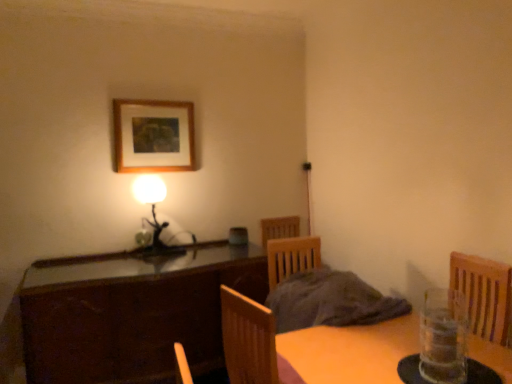
Question: In the image, is wooden picture frame at upper center positioned in front of or behind dark wood cabinet at center?

Choices:
 (A) behind
 (B) front

Answer: (A)

Question: Is point (142, 147) closer or farther from the camera than point (22, 322)?

Choices:
 (A) closer
 (B) farther

Answer: (B)

Question: Which object is positioned farthest from the clear glass vase at lower right?

Choices:
 (A) wooden picture frame at upper center
 (B) matte black lamp at left
 (C) dark wood cabinet at center

Answer: (A)

Question: Which of these objects is positioned closest to the matte black lamp at left?

Choices:
 (A) clear glass vase at lower right
 (B) wooden picture frame at upper center
 (C) dark wood cabinet at center

Answer: (B)